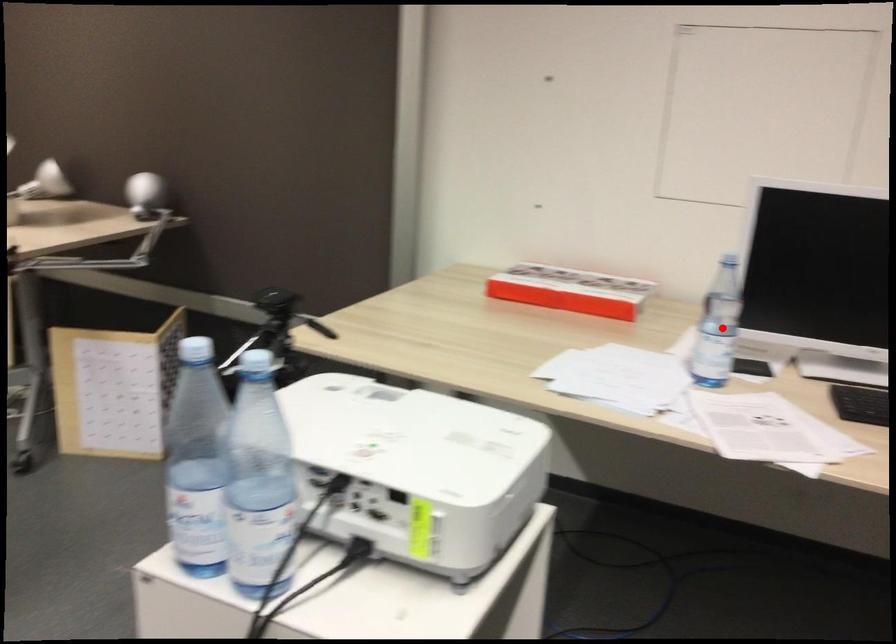
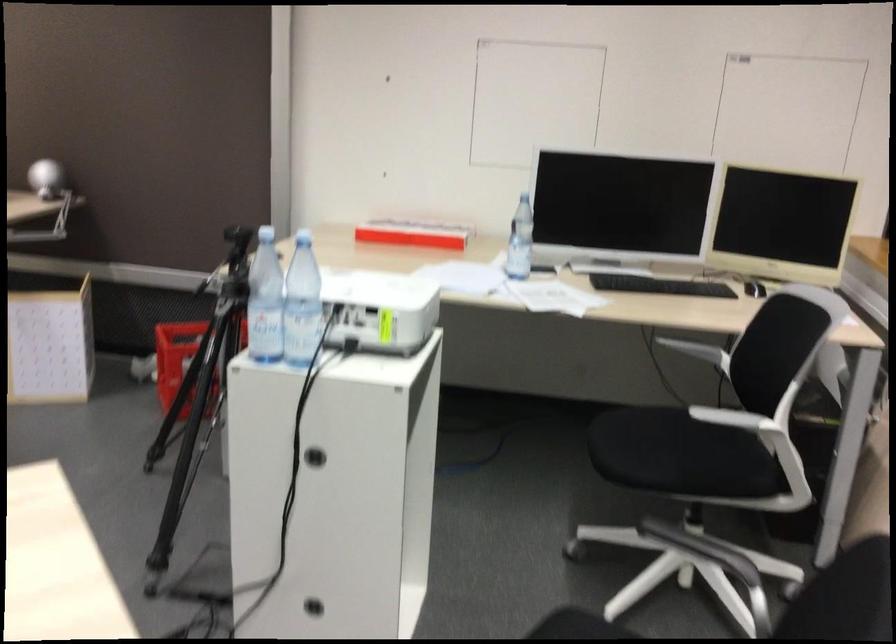
Question: I am providing you with two images of the same scene from different viewpoints. In image1, a red point is highlighted. Considering the same 3D point in image2, which of the following is correct?

Choices:
 (A) It is closer
 (B) It is farther

Answer: (B)